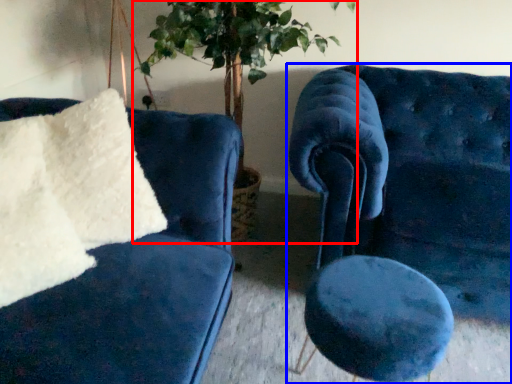
Question: Which object is further to the camera taking this photo, houseplant (highlighted by a red box) or chair (highlighted by a blue box)?

Choices:
 (A) houseplant
 (B) chair

Answer: (A)